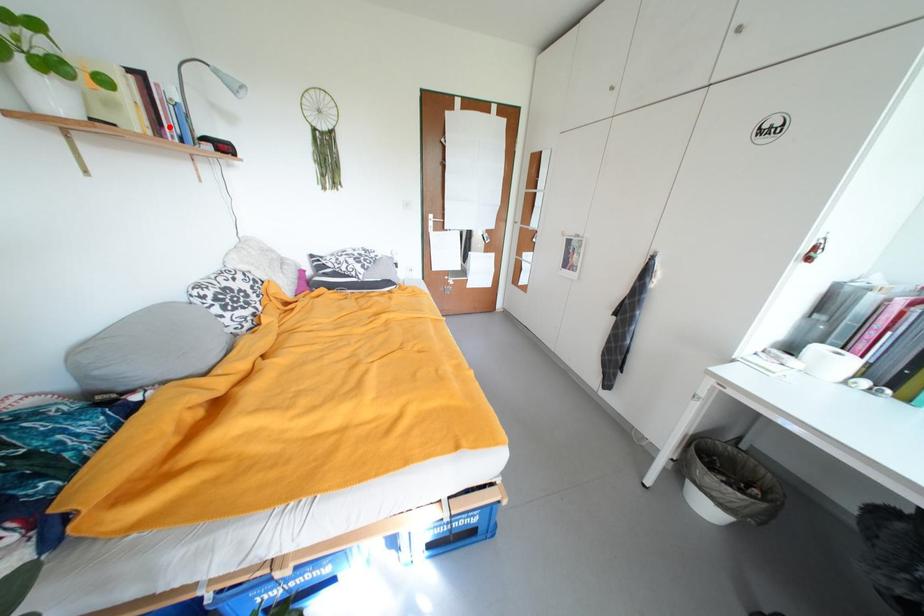
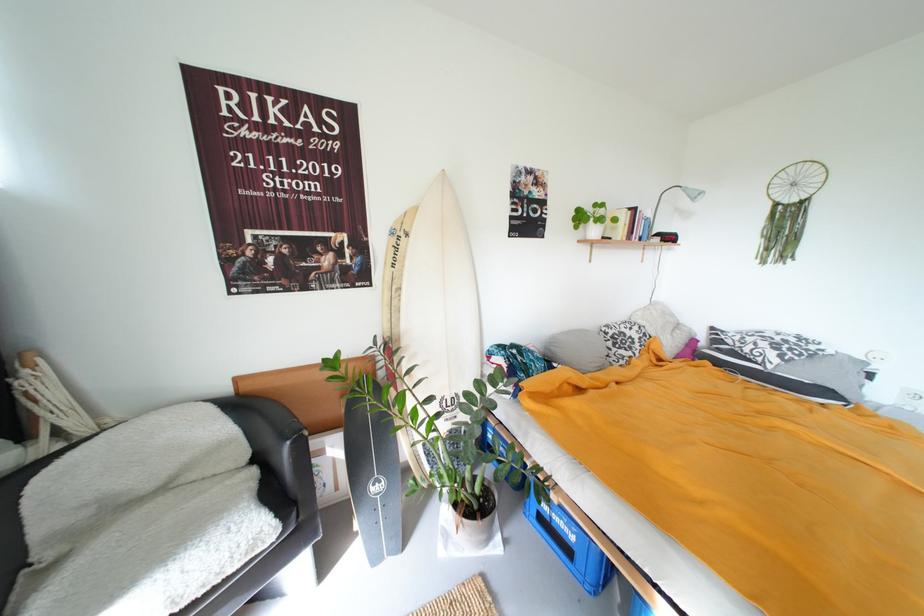
Where in the second image is the point corresponding to the highlighted location from the first image?

(639, 235)